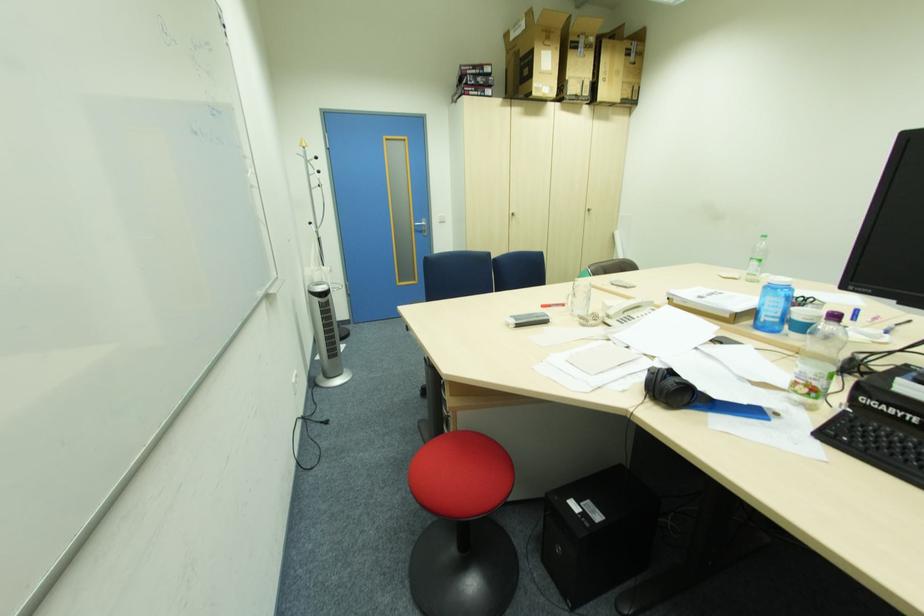
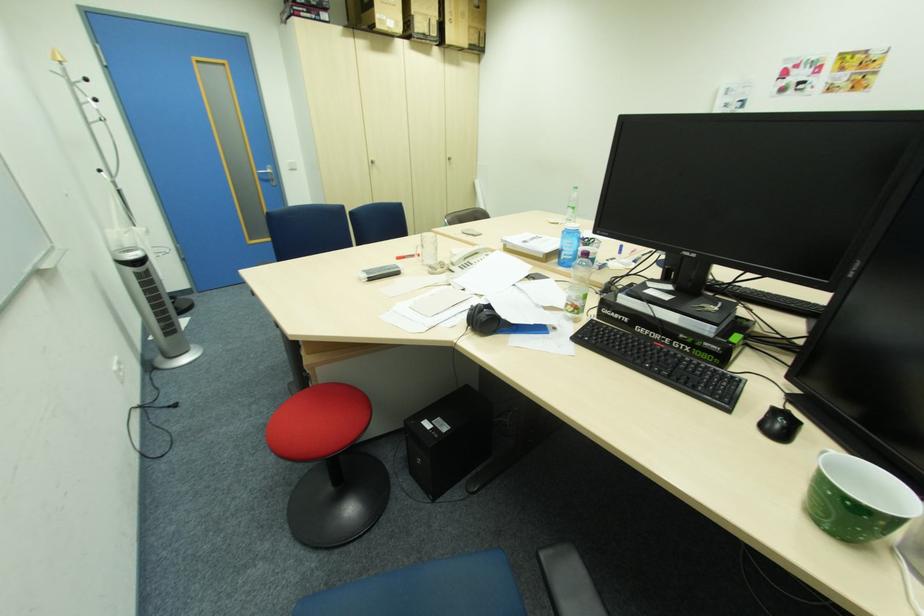
In the second image, find the point that corresponds to pixel 594 211 in the first image.

(456, 159)